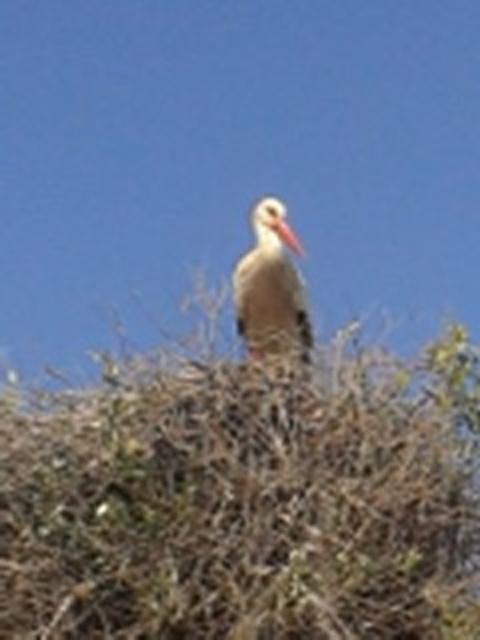
You are a wildlife photographer trying to capture a closeup of the white matte bird at center and the white matte beak at center. If your camera can only focus on one object at a time, which object should you focus on to ensure the larger subject is in sharp detail?

The white matte bird at center is bigger than the white matte beak at center, so you should focus on the white matte bird at center to ensure the larger subject is in sharp detail.

Consider the image. You are a birdwatcher trying to identify the stork in the image. The stork has a white matte beak at center and is perched on a brown textured nest at upper center. Which object is bigger in size?

The brown textured nest at upper center is larger in size than the white matte beak at center.

You are a wildlife photographer aiming to capture a photo of the white matte bird at center. You notice the brown textured nest at upper center where it is perched. Considering their heights, which one is taller?

The brown textured nest at upper center is taller than the white matte bird at center.